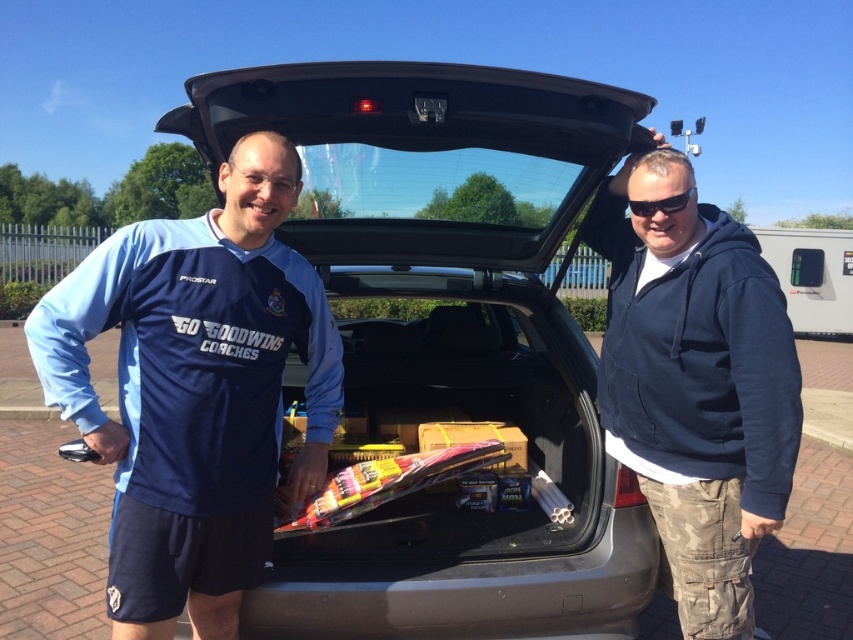
What is the exact coordinate of the navy blue hoodie at center?

The navy blue hoodie at center is located at point (695, 385).

You are helping to organize items in the car trunk. You need to place a new item between the navy blue hoodie at center and the black plastic goggles at upper center. Based on their sizes, which object should be placed on top to ensure stability?

The navy blue hoodie at center is much taller than the black plastic goggles at upper center, so placing the navy blue hoodie at center on top would provide better stability due to its larger size.